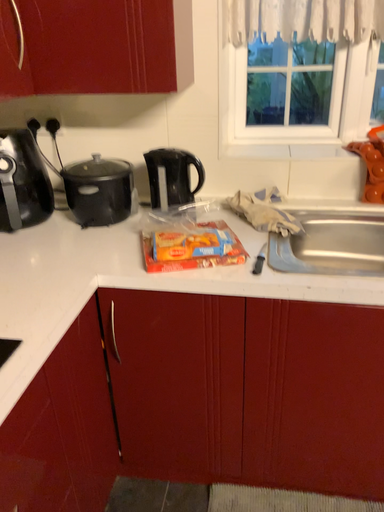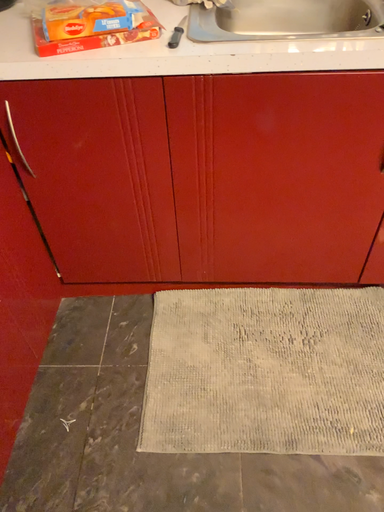
Question: Which way did the camera rotate in the video?

Choices:
 (A) rotated left
 (B) rotated right

Answer: (B)